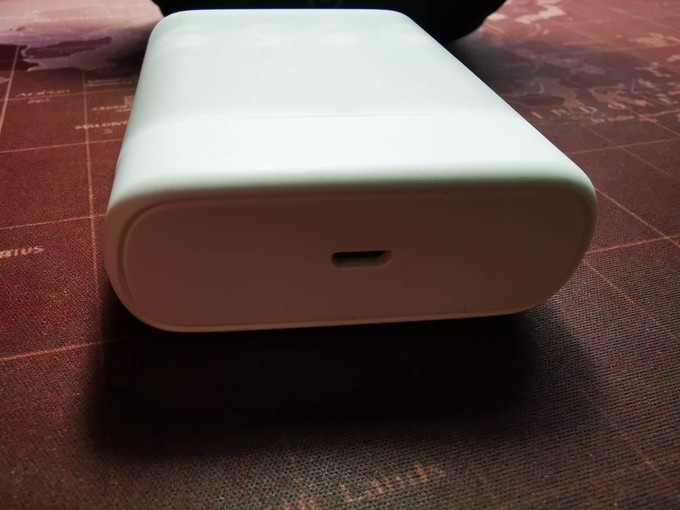
Identify the location of charger. Image resolution: width=680 pixels, height=510 pixels. (220, 161).